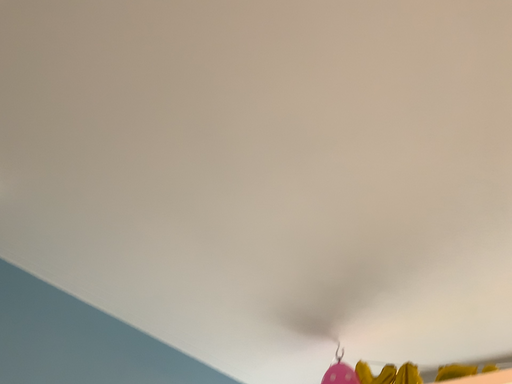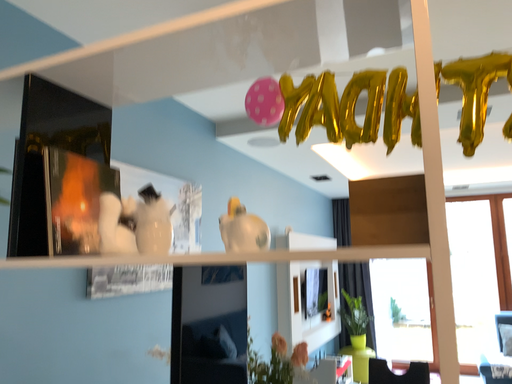
Question: Which way did the camera rotate in the video?

Choices:
 (A) rotated downward
 (B) rotated upward

Answer: (A)